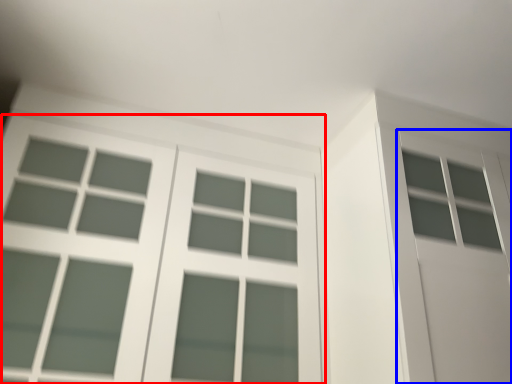
Question: Among these objects, which one is nearest to the camera, window (highlighted by a red box) or screen door (highlighted by a blue box)?

Choices:
 (A) window
 (B) screen door

Answer: (A)